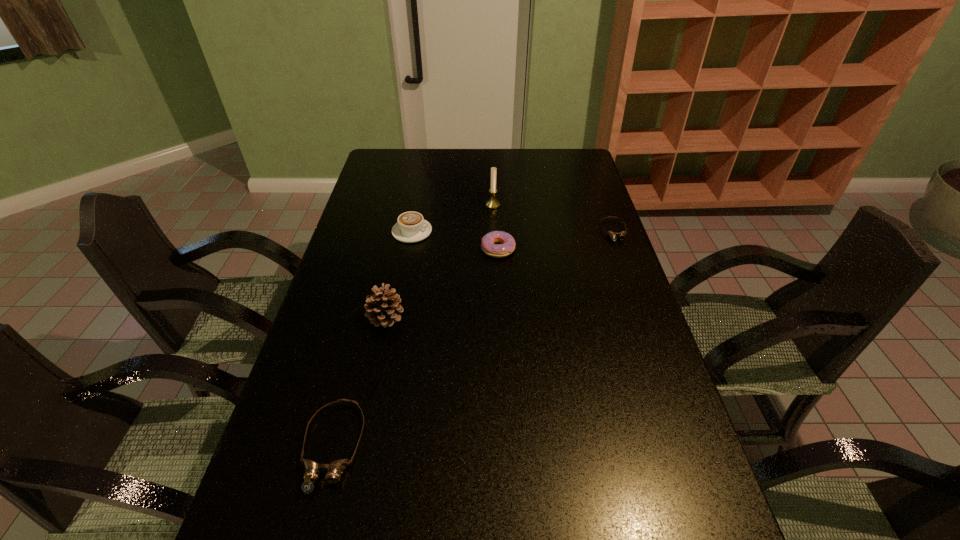
At what (x,y) coordinates should I click in order to perform the action: click on vacant position for inserting another goggles evenly. Please return your answer as a coordinate pair (x, y). Image resolution: width=960 pixels, height=540 pixels. Looking at the image, I should click on (505, 314).